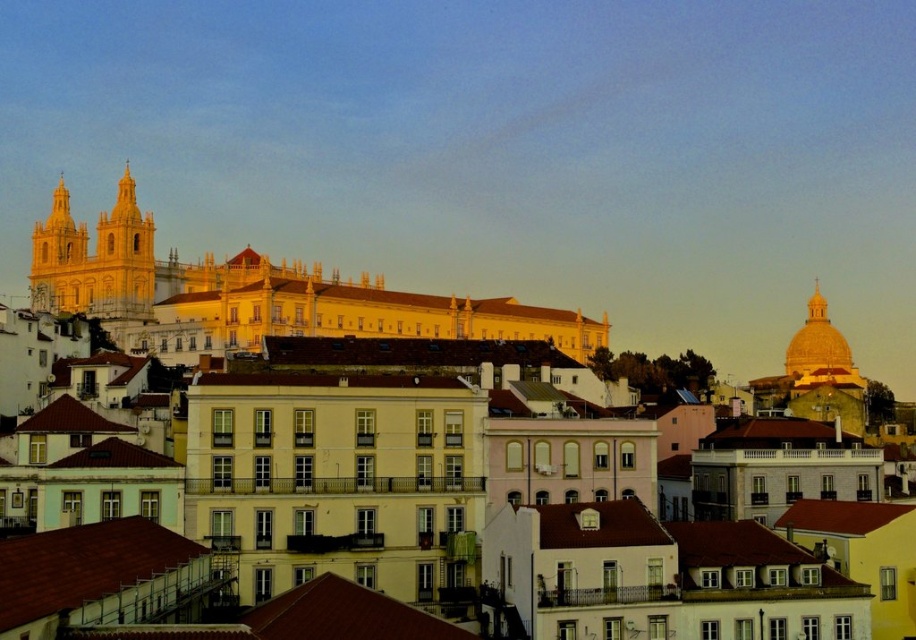
Question: Can you confirm if golden stone church at left is positioned to the right of golden dome at upper right?

Choices:
 (A) yes
 (B) no

Answer: (B)

Question: Which of the following is the closest to the observer?

Choices:
 (A) golden stone church at left
 (B) golden dome at upper right

Answer: (B)

Question: Can you confirm if golden stone church at left is positioned to the left of golden dome at upper right?

Choices:
 (A) yes
 (B) no

Answer: (A)

Question: Observing the image, what is the correct spatial positioning of golden stone church at left in reference to golden dome at upper right?

Choices:
 (A) below
 (B) above

Answer: (B)